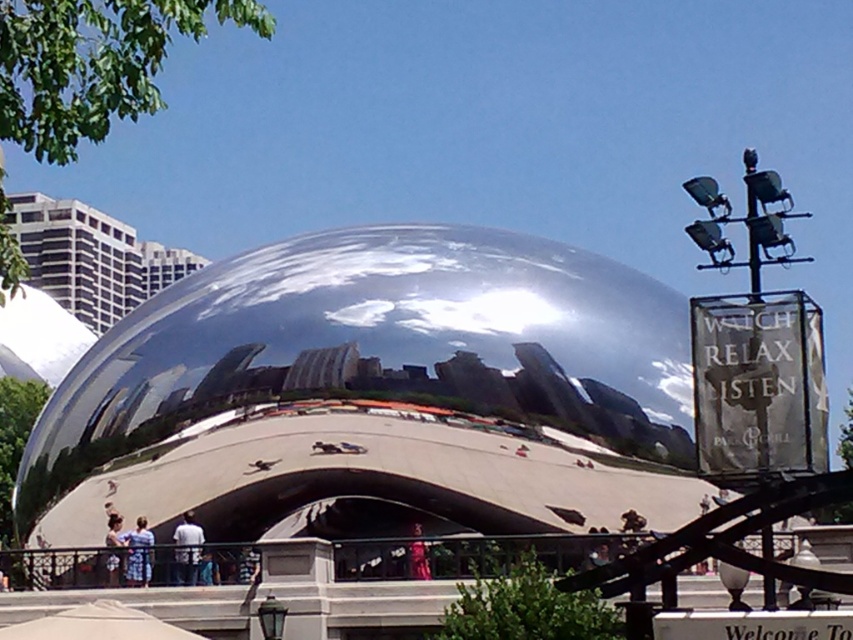
Does point (181, 570) come closer to viewer compared to point (416, 545)?

No, (181, 570) is behind (416, 545).

Does light blue jeans at lower center appear on the right side of matte pink dress at center?

No, light blue jeans at lower center is not to the right of matte pink dress at center.

Locate an element on the screen. This screenshot has width=853, height=640. light blue jeans at lower center is located at coordinates (187, 548).

This screenshot has width=853, height=640. Find the location of `light blue jeans at lower center`. light blue jeans at lower center is located at coordinates (187, 548).

Is point (137, 536) farther from camera compared to point (119, 557)?

Yes, point (137, 536) is farther from viewer.

Looking at this image, does blue denim jeans at lower center have a larger size compared to blue denim jeans at lower left?

Correct, blue denim jeans at lower center is larger in size than blue denim jeans at lower left.

What do you see at coordinates (138, 554) in the screenshot? I see `blue denim jeans at lower center` at bounding box center [138, 554].

The width and height of the screenshot is (853, 640). Identify the location of blue denim jeans at lower center. (138, 554).

Who is taller, light blue jeans at lower center or blue denim jeans at lower left?

light blue jeans at lower center is taller.

Describe the element at coordinates (187, 548) in the screenshot. The width and height of the screenshot is (853, 640). I see `light blue jeans at lower center` at that location.

This screenshot has height=640, width=853. What do you see at coordinates (187, 548) in the screenshot? I see `light blue jeans at lower center` at bounding box center [187, 548].

You are a GUI agent. You are given a task and a screenshot of the screen. Output one action in this format:
    pyautogui.click(x=<x>, y=<y>)
    Task: Click on the light blue jeans at lower center
    
    Given the screenshot: What is the action you would take?
    pyautogui.click(x=187, y=548)